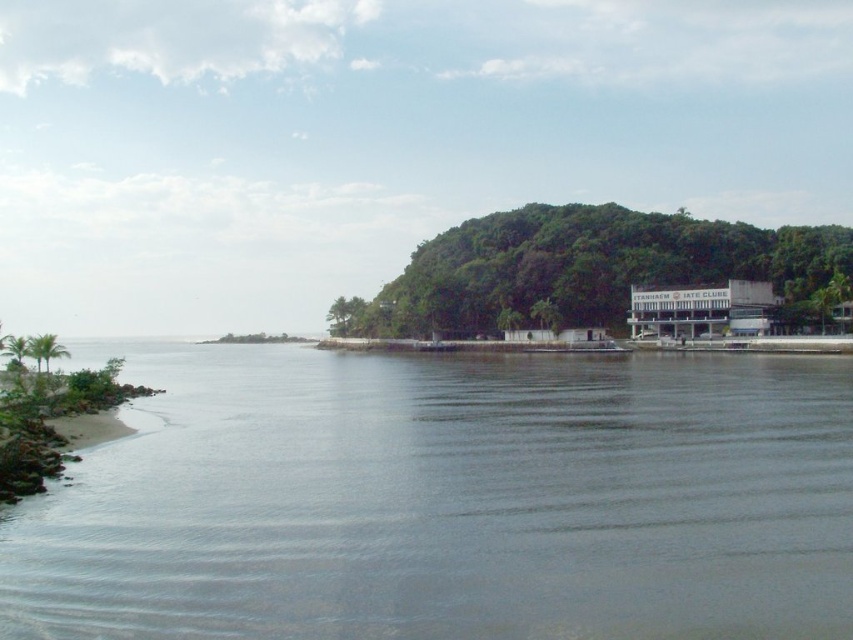
Who is higher up, green leafy trees at center or green leafy tree at center?

Positioned higher is green leafy trees at center.

Find the location of a particular element. green leafy trees at center is located at coordinates (587, 268).

Can you confirm if gray smooth water at center is positioned below green leafy palm tree at lower left?

Correct, gray smooth water at center is located below green leafy palm tree at lower left.

Is point (189, 589) closer to viewer compared to point (49, 342)?

Yes.

Which is in front, point (71, 554) or point (30, 355)?

Point (71, 554)

Where is `gray smooth water at center`? Image resolution: width=853 pixels, height=640 pixels. gray smooth water at center is located at coordinates (447, 500).

Who is taller, gray smooth water at center or green leafy trees at center?

green leafy trees at center

Does gray smooth water at center have a lesser width compared to green leafy trees at center?

Correct, gray smooth water at center's width is less than green leafy trees at center's.

Does point (409, 426) come in front of point (489, 323)?

Yes, it is in front of point (489, 323).

You are a GUI agent. You are given a task and a screenshot of the screen. Output one action in this format:
    pyautogui.click(x=<x>, y=<y>)
    Task: Click on the gray smooth water at center
    Image resolution: width=853 pixels, height=640 pixels.
    Given the screenshot: What is the action you would take?
    pyautogui.click(x=447, y=500)